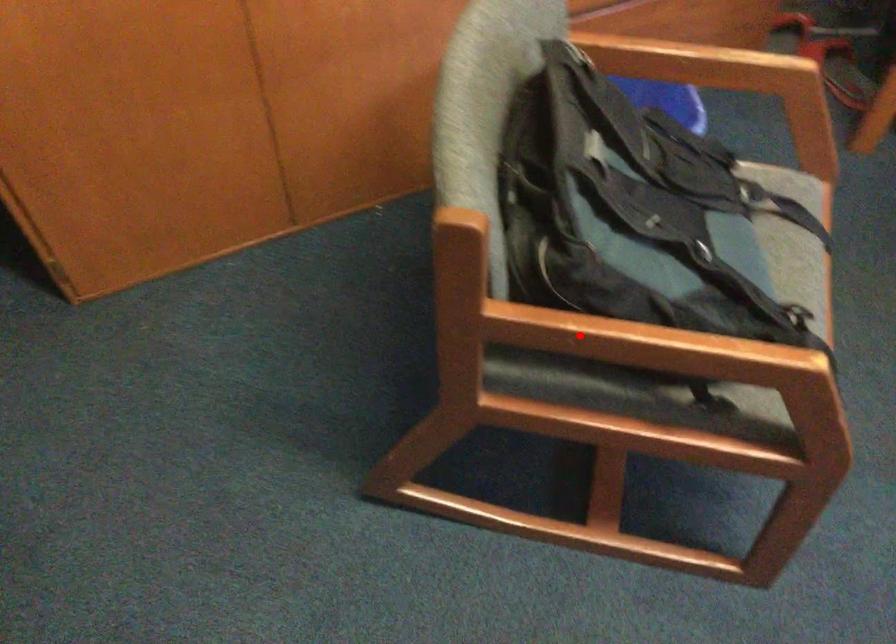
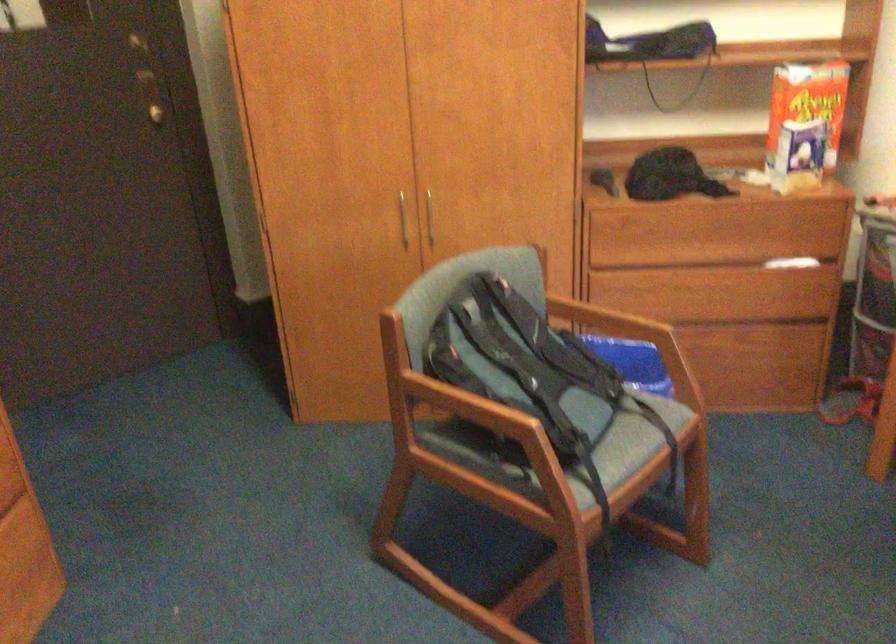
Find the pixel in the second image that matches the highlighted location in the first image.

(442, 402)